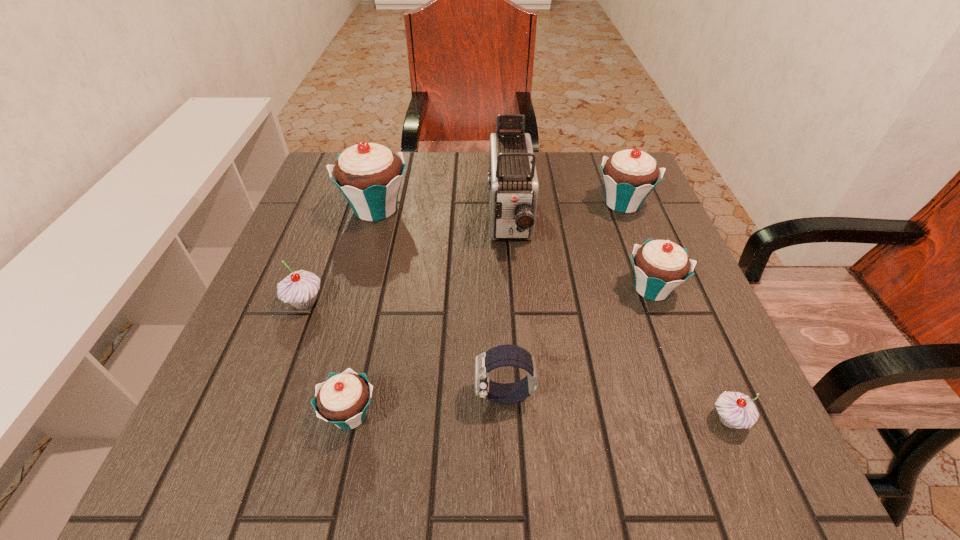
This screenshot has width=960, height=540. What are the coordinates of `the nearer gray cupcake` in the screenshot? It's located at [736, 410].

You are a GUI agent. You are given a task and a screenshot of the screen. Output one action in this format:
    pyautogui.click(x=<x>, y=<y>)
    Task: Click on the smallest teal cupcake
    The width and height of the screenshot is (960, 540).
    Given the screenshot: What is the action you would take?
    pyautogui.click(x=343, y=398)

In order to click on free space located 0.250m at the lens of the camcorder in this screenshot , I will do coord(519,356).

Image resolution: width=960 pixels, height=540 pixels. I want to click on vacant region located 0.300m on the front of the biggest teal cupcake, so click(x=340, y=338).

The height and width of the screenshot is (540, 960). Identify the location of blank space located 0.060m on the back of the third smallest teal cupcake. (612, 174).

Identify the location of vacant space located 0.130m on the front of the left gray cupcake. (276, 378).

This screenshot has width=960, height=540. In order to click on free location located on the front of the second nearest teal cupcake in this screenshot , I will do `click(676, 350)`.

Locate an element on the screen. This screenshot has width=960, height=540. vacant space located 0.330m on the face of the watch is located at coordinates (269, 396).

I want to click on vacant area located 0.060m on the face of the watch, so click(438, 396).

Identify the location of vacant space located on the face of the watch. (444, 396).